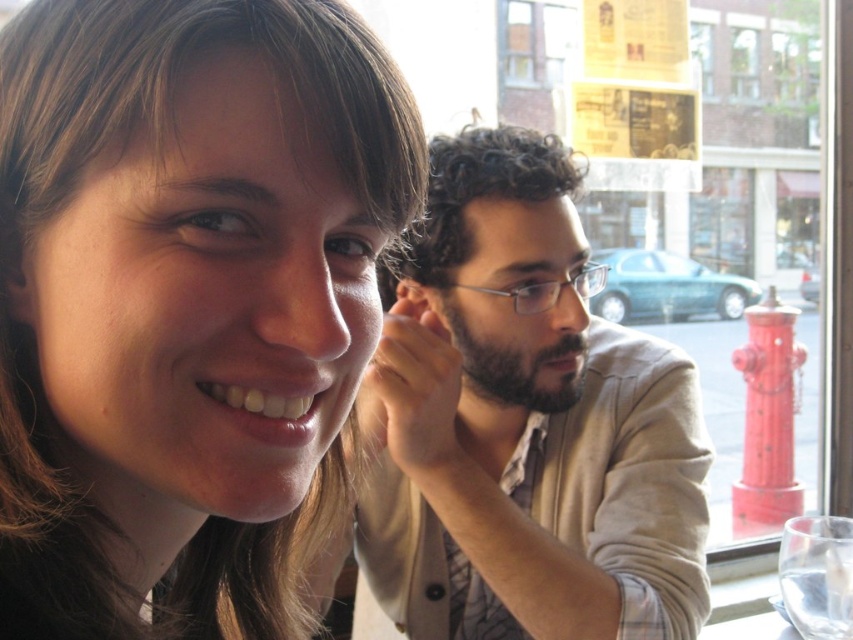
You are a photographer setting up a shot of the light beige sweater at center and the clear glass at lower right. Which object should you focus on first if you want to capture both in a single frame without moving the camera?

The light beige sweater at center should be focused on first because it is taller than the clear glass at lower right, ensuring its full height is captured before adjusting focus to the shorter glass.